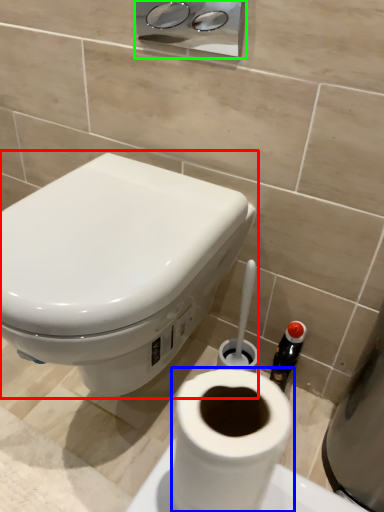
Question: Which object is the closest to the toilet (highlighted by a red box)? Choose among these: toilet paper (highlighted by a blue box) or dispenser (highlighted by a green box).

Choices:
 (A) toilet paper
 (B) dispenser

Answer: (A)